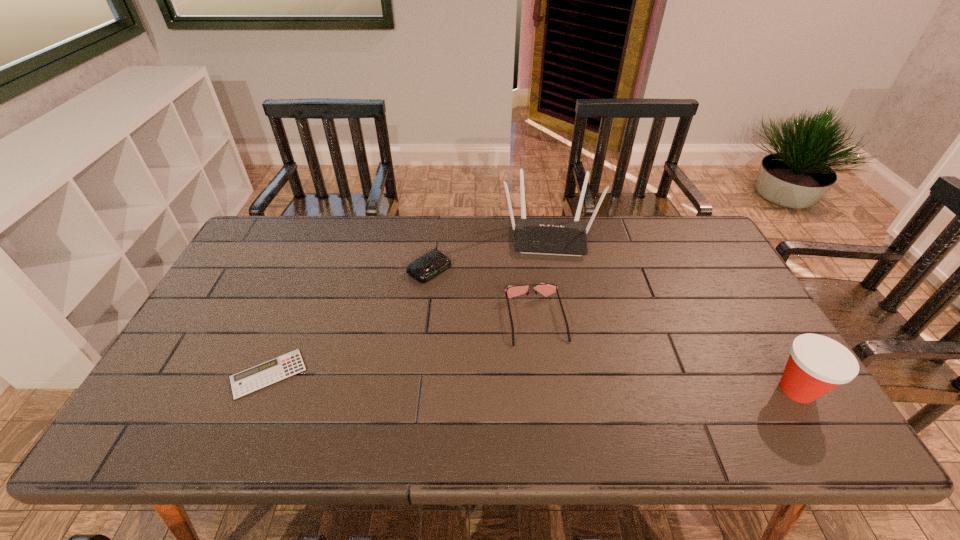
Locate an element on the screen. Image resolution: width=960 pixels, height=540 pixels. vacant space located 0.260m on the back of the second tallest object is located at coordinates (739, 294).

Where is `free region located 0.140m on the display of the second shortest object`? Image resolution: width=960 pixels, height=540 pixels. free region located 0.140m on the display of the second shortest object is located at coordinates (477, 303).

Image resolution: width=960 pixels, height=540 pixels. I want to click on blank space located 0.230m on the display of the second shortest object, so click(500, 319).

The image size is (960, 540). What are the coordinates of `free space located 0.120m on the display of the second shortest object` in the screenshot? It's located at (472, 299).

You are a GUI agent. You are given a task and a screenshot of the screen. Output one action in this format:
    pyautogui.click(x=<x>, y=<y>)
    Task: Click on the vacant area situated on the bridge of the third tallest object
    
    Given the screenshot: What is the action you would take?
    pyautogui.click(x=545, y=362)

You are a GUI agent. You are given a task and a screenshot of the screen. Output one action in this format:
    pyautogui.click(x=<x>, y=<y>)
    Task: Click on the vacant space situated on the bridge of the third tallest object
    This screenshot has height=540, width=960.
    Given the screenshot: What is the action you would take?
    pyautogui.click(x=553, y=393)

Find the location of `blank area located on the bridge of the third tallest object`. blank area located on the bridge of the third tallest object is located at coordinates (556, 404).

I want to click on vacant area located 0.090m on the front-facing side of the router, so click(x=551, y=279).

The image size is (960, 540). I want to click on free location located on the front-facing side of the router, so click(x=553, y=305).

The image size is (960, 540). In order to click on vacant position located 0.120m on the front-facing side of the router in this screenshot , I will do `click(552, 285)`.